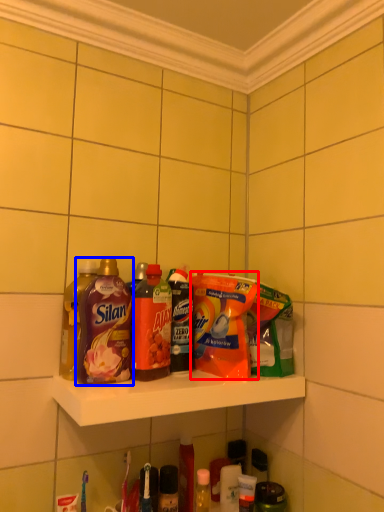
Question: Which of the following is the farthest to the observer, cleaning product (highlighted by a red box) or bottle (highlighted by a blue box)?

Choices:
 (A) cleaning product
 (B) bottle

Answer: (A)